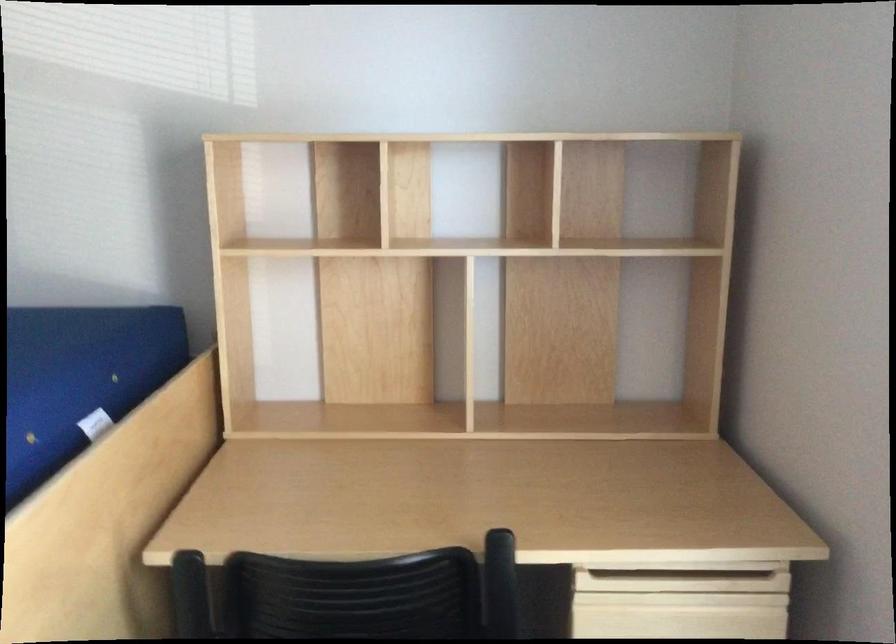
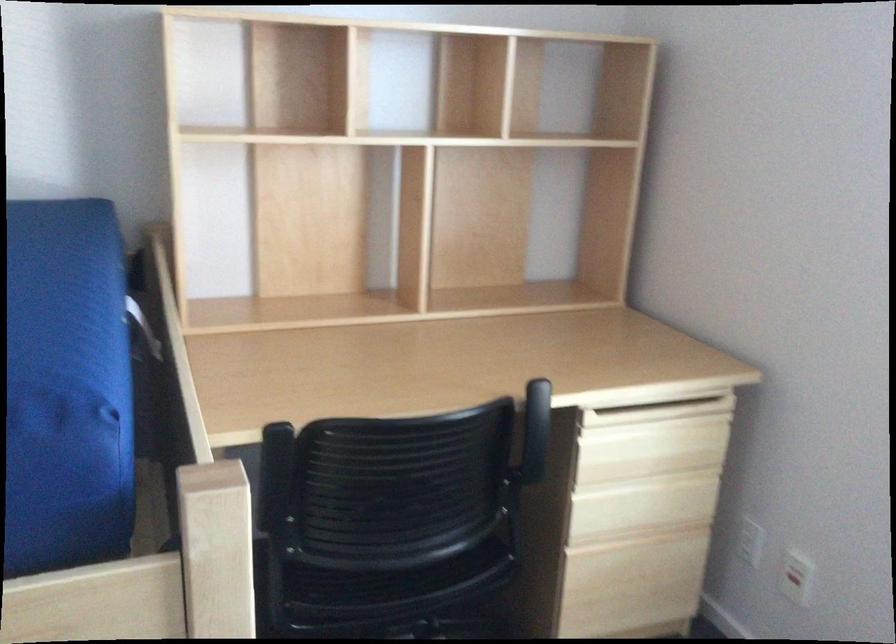
Find the pixel in the second image that matches the point at 494,574 in the first image.

(536, 417)